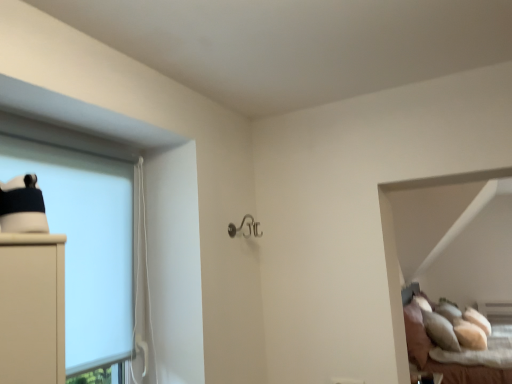
Question: Does point (432, 370) appear closer or farther from the camera than point (33, 162)?

Choices:
 (A) closer
 (B) farther

Answer: (B)

Question: Considering the positions of soft beige pillows at lower right and white matte cabinet at left in the image, is soft beige pillows at lower right bigger or smaller than white matte cabinet at left?

Choices:
 (A) small
 (B) big

Answer: (B)

Question: Visually, is soft beige pillows at lower right positioned to the left or to the right of white matte cabinet at left?

Choices:
 (A) right
 (B) left

Answer: (A)

Question: Is white matte cabinet at left in front of or behind soft beige pillows at lower right in the image?

Choices:
 (A) front
 (B) behind

Answer: (A)

Question: From their relative heights in the image, would you say white matte cabinet at left is taller or shorter than soft beige pillows at lower right?

Choices:
 (A) short
 (B) tall

Answer: (A)

Question: Is white matte cabinet at left bigger or smaller than soft beige pillows at lower right?

Choices:
 (A) small
 (B) big

Answer: (A)

Question: From a real-world perspective, relative to soft beige pillows at lower right, is white matte cabinet at left vertically above or below?

Choices:
 (A) above
 (B) below

Answer: (A)